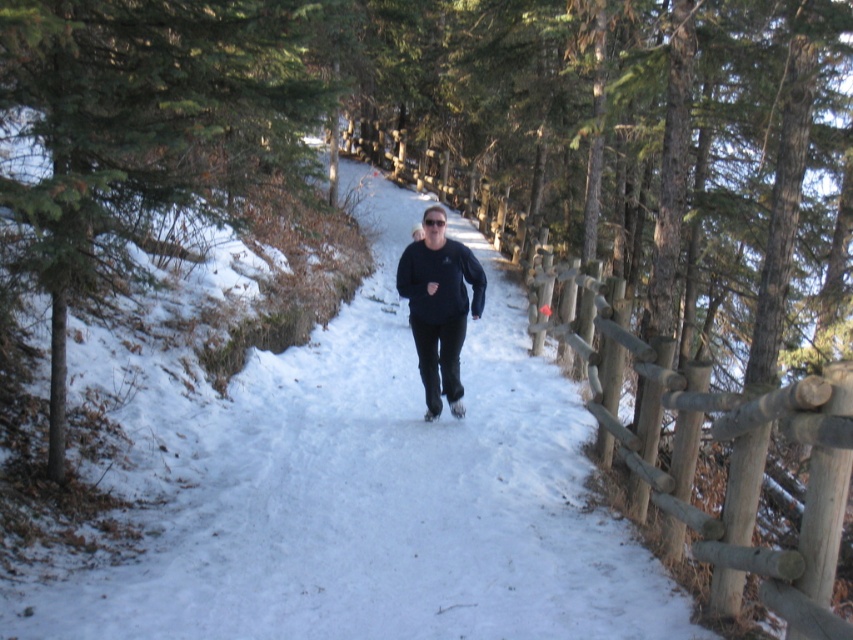
Question: Which point is farther to the camera?

Choices:
 (A) green evergreen tree at left
 (B) black matte pants at center

Answer: (B)

Question: Which object appears closest to the camera in this image?

Choices:
 (A) black matte pants at center
 (B) green evergreen tree at left
 (C) wooden fence at center-right

Answer: (C)

Question: Where is wooden fence at center-right located in relation to black matte pants at center in the image?

Choices:
 (A) below
 (B) above

Answer: (A)

Question: Estimate the real-world distances between objects in this image. Which object is farther from the wooden fence at center-right?

Choices:
 (A) green evergreen tree at left
 (B) black matte pants at center

Answer: (A)

Question: Does green evergreen tree at left have a greater width compared to black matte pants at center?

Choices:
 (A) no
 (B) yes

Answer: (B)

Question: Can you confirm if green evergreen tree at left is positioned to the left of black matte pants at center?

Choices:
 (A) yes
 (B) no

Answer: (A)